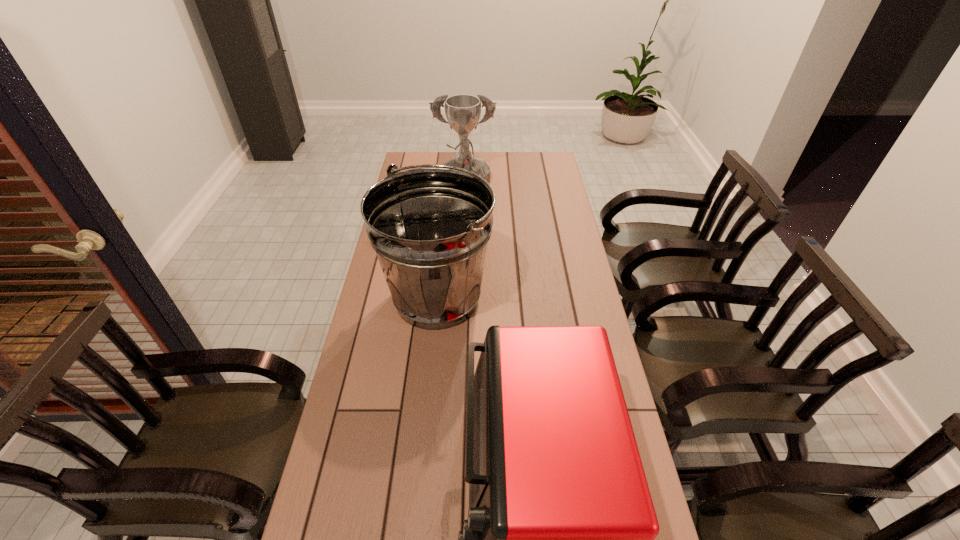
At what (x,y) coordinates should I click in order to perform the action: click on the second farthest object. Please return your answer as a coordinate pair (x, y). Looking at the image, I should click on (430, 227).

Locate an element on the screen. the farthest object is located at coordinates (463, 112).

Locate an element on the screen. Image resolution: width=960 pixels, height=540 pixels. free space located 0.170m on the right of the second farthest object is located at coordinates (543, 298).

The image size is (960, 540). Find the location of `free location located 0.380m on the side with emblem of the farthest object`. free location located 0.380m on the side with emblem of the farthest object is located at coordinates (461, 262).

Image resolution: width=960 pixels, height=540 pixels. What are the coordinates of `object that is at the far edge` in the screenshot? It's located at (463, 112).

This screenshot has height=540, width=960. I want to click on object that is at the left edge, so click(430, 227).

Find the location of a particular element. This screenshot has width=960, height=540. free location at the far edge is located at coordinates (521, 157).

The width and height of the screenshot is (960, 540). Find the location of `vacant area at the left edge`. vacant area at the left edge is located at coordinates (312, 535).

Where is `free space at the right edge`? free space at the right edge is located at coordinates (542, 188).

This screenshot has width=960, height=540. In the image, there is a desktop. Identify the location of vacant space at the far left corner. (411, 154).